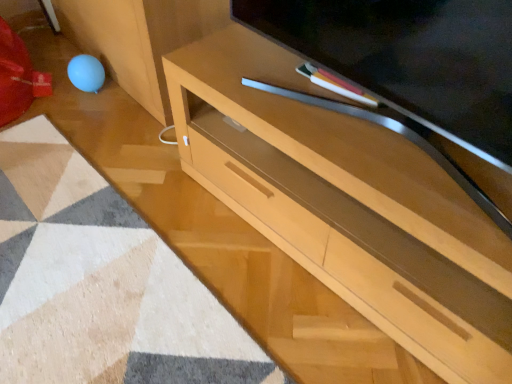
What is the approximate height of light wood desk at center?

light wood desk at center is 19.27 inches in height.

Measure the distance between point (x=240, y=7) and camera.

Point (x=240, y=7) and camera are 1.23 meters apart.

What do you see at coordinates (100, 283) in the screenshot? This screenshot has width=512, height=384. I see `beige textured mat at lower left` at bounding box center [100, 283].

The width and height of the screenshot is (512, 384). I want to click on light wood desk at center, so click(x=347, y=205).

Between light wood desk at center and matte wood television at center, which one has less height?

With less height is matte wood television at center.

Is light wood desk at center outside of matte wood television at center?

light wood desk at center is positioned outside matte wood television at center.

Is light wood desk at center at the right side of matte wood television at center?

Yes, light wood desk at center is to the right of matte wood television at center.

From the image's perspective, which is above, light wood desk at center or matte wood television at center?

matte wood television at center.

Considering the positions of point (275, 2) and point (110, 356), is point (275, 2) closer or farther from the camera than point (110, 356)?

Clearly, point (275, 2) is more distant from the camera than point (110, 356).

From a real-world perspective, is matte wood television at center positioned under beige textured mat at lower left based on gravity?

No, from a real-world perspective, matte wood television at center is not under beige textured mat at lower left.

Can you confirm if matte wood television at center is shorter than beige textured mat at lower left?

No.

Would you say matte wood television at center is outside beige textured mat at lower left?

Yes.

Consider the image. From a real-world perspective, relative to light wood desk at center, is beige textured mat at lower left vertically above or below?

beige textured mat at lower left is below light wood desk at center.

Is beige textured mat at lower left in contact with light wood desk at center?

No, beige textured mat at lower left is not making contact with light wood desk at center.

Considering the relative sizes of beige textured mat at lower left and light wood desk at center in the image provided, is beige textured mat at lower left taller than light wood desk at center?

Incorrect, the height of beige textured mat at lower left is not larger of that of light wood desk at center.

How many degrees apart are the facing directions of beige textured mat at lower left and light wood desk at center?

The facing directions of beige textured mat at lower left and light wood desk at center are 87 degrees apart.

Consider the image. Between beige textured mat at lower left and matte wood television at center, which one has smaller size?

beige textured mat at lower left is smaller.

Looking at this image, from a real-world perspective, who is located higher, beige textured mat at lower left or matte wood television at center?

matte wood television at center, from a real-world perspective.

Based on the photo, who is shorter, beige textured mat at lower left or matte wood television at center?

With less height is beige textured mat at lower left.

In the scene shown: Is beige textured mat at lower left spatially inside matte wood television at center, or outside of it?

beige textured mat at lower left is not enclosed by matte wood television at center.

Looking at this image, from a real-world perspective, is matte wood television at center physically located above or below light wood desk at center?

In terms of real-world spatial position, matte wood television at center is above light wood desk at center.

Does matte wood television at center have a greater height compared to light wood desk at center?

Incorrect, the height of matte wood television at center is not larger of that of light wood desk at center.

Would you say matte wood television at center is outside light wood desk at center?

Yes, matte wood television at center is not within light wood desk at center.

Is matte wood television at center bigger than light wood desk at center?

No, matte wood television at center is not bigger than light wood desk at center.

Which of these two, light wood desk at center or beige textured mat at lower left, is smaller?

beige textured mat at lower left.

Is light wood desk at center positioned far away from beige textured mat at lower left?

No.

Does light wood desk at center appear on the left side of beige textured mat at lower left?

No, light wood desk at center is not to the left of beige textured mat at lower left.

Identify the location of desk on the right side of beige textured mat at lower left. The image size is (512, 384). (347, 205).

Find the location of `television to the left of light wood desk at center`. television to the left of light wood desk at center is located at coordinates (409, 58).

At what (x,y) coordinates should I click in order to perform the action: click on television in front of the beige textured mat at lower left. Please return your answer as a coordinate pair (x, y). Looking at the image, I should click on (409, 58).

Considering their positions, is matte wood television at center positioned further to light wood desk at center than beige textured mat at lower left?

beige textured mat at lower left is further to light wood desk at center.

Estimate the real-world distances between objects in this image. Which object is further from matte wood television at center, beige textured mat at lower left or light wood desk at center?

beige textured mat at lower left is positioned further to the anchor matte wood television at center.

Looking at the image, which one is located further to beige textured mat at lower left, light wood desk at center or matte wood television at center?

Based on the image, matte wood television at center appears to be further to beige textured mat at lower left.

Based on the photo, considering their positions, is beige textured mat at lower left positioned closer to light wood desk at center than matte wood television at center?

matte wood television at center.

Based on their spatial positions, is light wood desk at center or beige textured mat at lower left closer to matte wood television at center?

Among the two, light wood desk at center is located nearer to matte wood television at center.

When comparing their distances from beige textured mat at lower left, does matte wood television at center or light wood desk at center seem further?

matte wood television at center.

The height and width of the screenshot is (384, 512). Identify the location of television between beige textured mat at lower left and light wood desk at center in the horizontal direction. (409, 58).